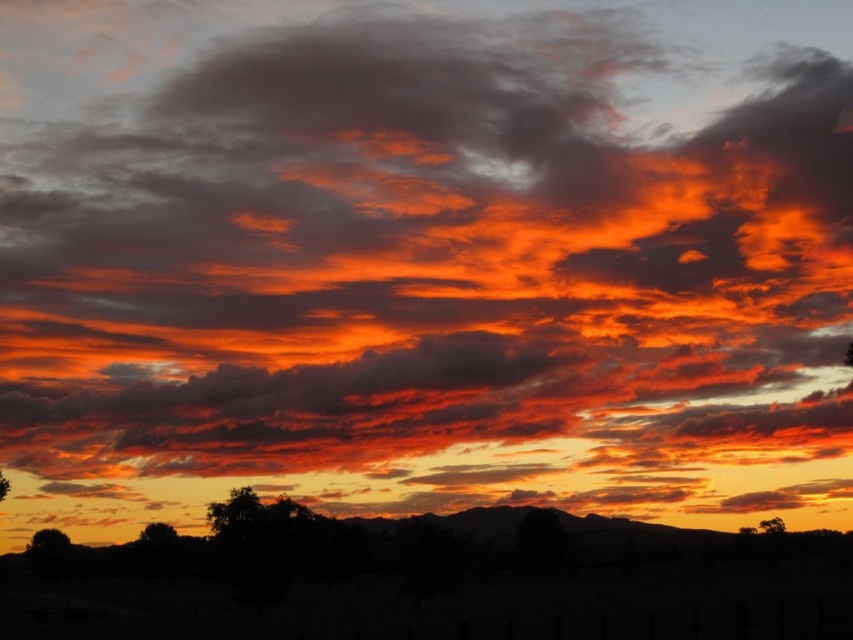
You are standing in the sunset scene and want to take a photo of both the silhouette tree at lower left and the green leafy tree at lower left. Which tree should you focus on first if you want to capture both in the same frame?

The silhouette tree at lower left is shorter than the green leafy tree at lower left. To capture both in the same frame, focus on the shorter silhouette tree at lower left first, then adjust the camera angle to include the taller green leafy tree at lower left.

You are standing in the sunset scene and want to take a photo of the silhouette tree at lower left. If your camera has a maximum zoom range of 100 meters, can you capture the tree without moving closer?

The silhouette tree at lower left is 150.20 meters from viewer. Since the camera can only zoom up to 100 meters, you cannot capture the tree clearly without moving closer.

You are a photographer standing at the center of the scene. You want to capture the silhouette tree at lower left in your photo. Based on its coordinates, where should you position your camera to ensure it is centered in the frame?

To center the silhouette tree at lower left in your photo, position your camera so that its coordinates align with the center of the frame at point approximately 0.848 on the x and 0.056 on the y axis.